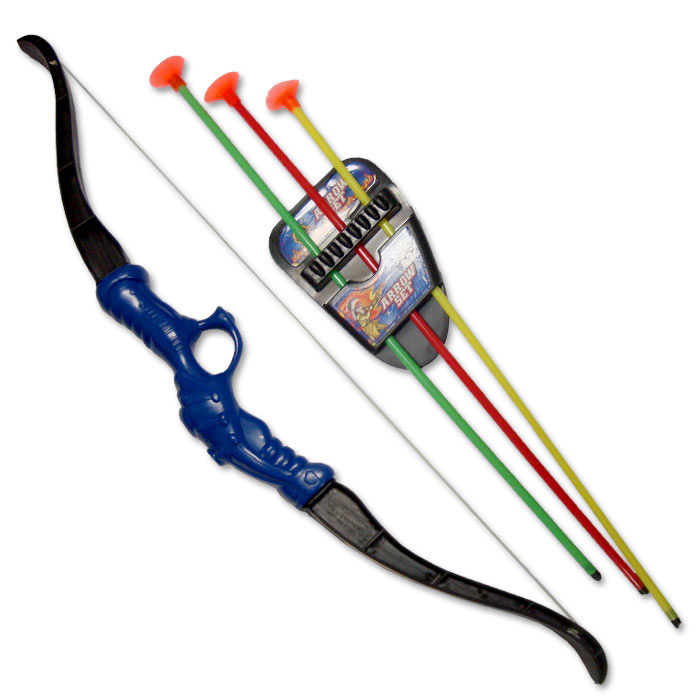
This screenshot has height=700, width=700. In order to click on christmas gift in this screenshot , I will do `click(404, 295)`.